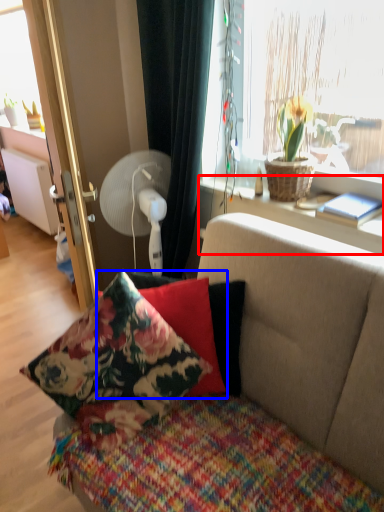
Question: Among these objects, which one is farthest to the camera, window sill (highlighted by a red box) or pillow (highlighted by a blue box)?

Choices:
 (A) window sill
 (B) pillow

Answer: (A)